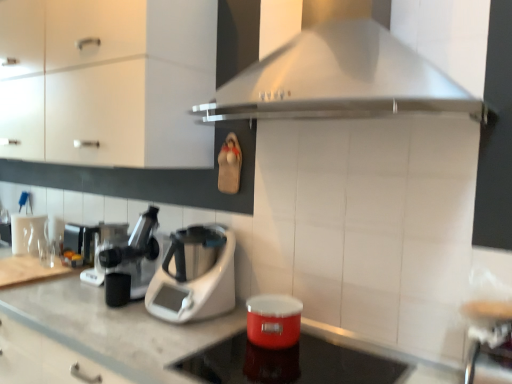
Image resolution: width=512 pixels, height=384 pixels. I want to click on vacant space underneath shiny red container at center (from a real-world perspective), so click(x=311, y=365).